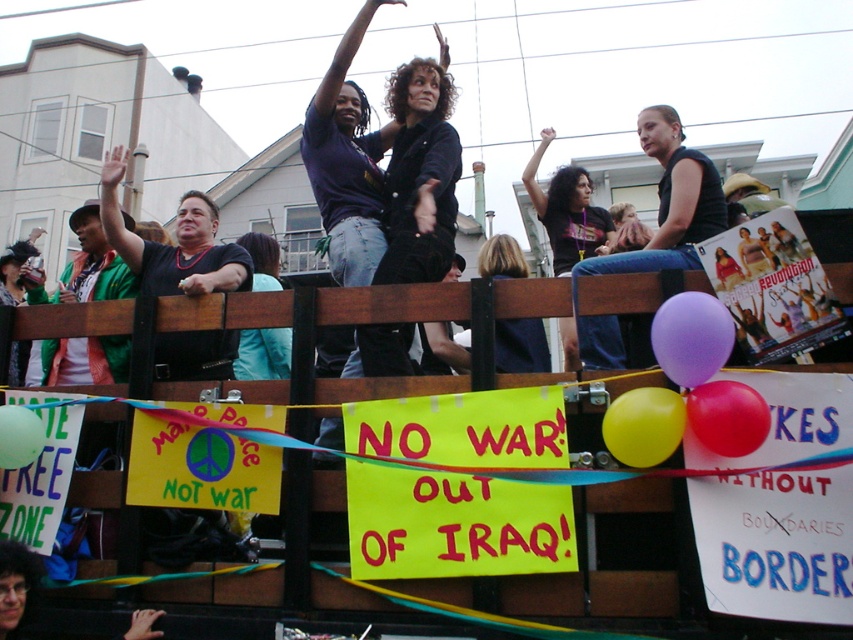
Is yellow rubber balloon at center to the right of rubber balloon at center from the viewer's perspective?

Incorrect, yellow rubber balloon at center is not on the right side of rubber balloon at center.

Does yellow rubber balloon at center have a larger size compared to rubber balloon at center?

Correct, yellow rubber balloon at center is larger in size than rubber balloon at center.

Locate an element on the screen. The image size is (853, 640). yellow rubber balloon at center is located at coordinates (643, 426).

You are a GUI agent. You are given a task and a screenshot of the screen. Output one action in this format:
    pyautogui.click(x=<x>, y=<y>)
    Task: Click on the yellow rubber balloon at center
    This screenshot has height=640, width=853.
    Given the screenshot: What is the action you would take?
    pyautogui.click(x=643, y=426)

Who is taller, purple rubber balloon at upper center or teal fabric shirt at center?

Standing taller between the two is teal fabric shirt at center.

Is point (677, 308) positioned after point (263, 368)?

No, it is not.

Identify the location of purple rubber balloon at upper center. (691, 337).

Can you confirm if purple rubber balloon at upper center is smaller than yellow rubber balloon at center?

Yes.

Locate an element on the screen. purple rubber balloon at upper center is located at coordinates (691, 337).